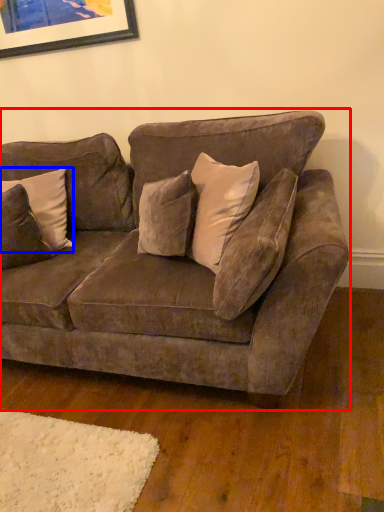
Question: Which object is further to the camera taking this photo, studio couch (highlighted by a red box) or pillow (highlighted by a blue box)?

Choices:
 (A) studio couch
 (B) pillow

Answer: (B)